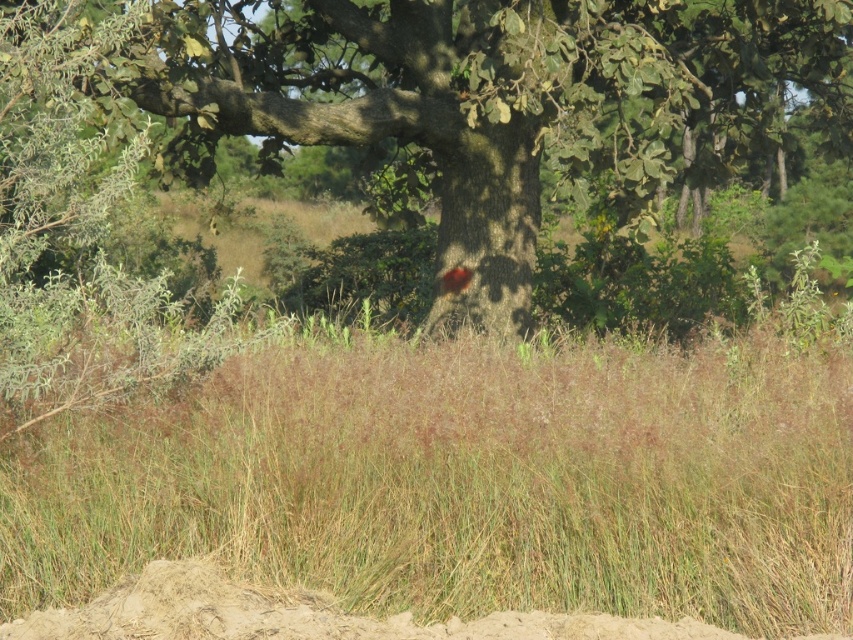
Between green grass at center and green rough bark tree at center, which one is positioned lower?

green grass at center

Does green grass at center come in front of green rough bark tree at center?

That is True.

Is point (402, 465) in front of point (238, 20)?

Yes, it is.

Identify the location of green grass at center. The image size is (853, 640). (463, 483).